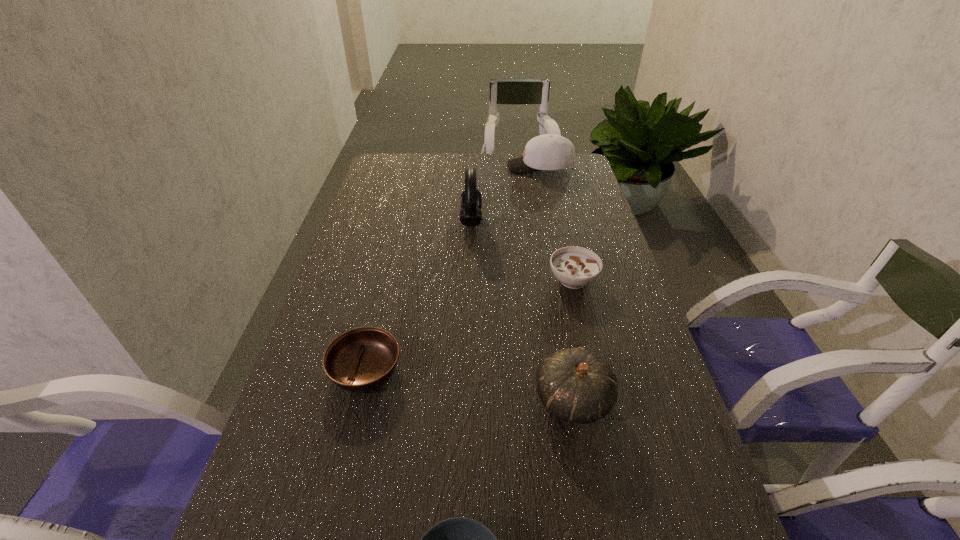
Find the location of `object that is the second closest one to the gourd`. object that is the second closest one to the gourd is located at coordinates (575, 267).

Locate which soup bowl ranks second in proximity to the third farthest object. Please provide its 2D coordinates. Your answer should be formatted as a tuple, i.e. [(x, y)], where the tuple contains the x and y coordinates of a point satisfying the conditions above.

[(459, 539)]

Where is `soup bowl that is the second closest to the headset`? The width and height of the screenshot is (960, 540). soup bowl that is the second closest to the headset is located at coordinates (362, 359).

At what (x,y) coordinates should I click in order to perform the action: click on blank area in the image that satisfies the following two spatial constraints: 1. on the earcups of the tallest object; 2. on the left side of the farthest soup bowl. Please return your answer as a coordinate pair (x, y). Looking at the image, I should click on (469, 280).

The width and height of the screenshot is (960, 540). In order to click on free space in the image that satisfies the following two spatial constraints: 1. on the front-facing side of the rightmost soup bowl; 2. on the right side of the baseball cap in this screenshot , I will do `click(564, 280)`.

You are a GUI agent. You are given a task and a screenshot of the screen. Output one action in this format:
    pyautogui.click(x=<x>, y=<y>)
    Task: Click on the free location that satisfies the following two spatial constraints: 1. on the front-facing side of the farthest object; 2. on the left side of the rightmost soup bowl
    The width and height of the screenshot is (960, 540).
    Given the screenshot: What is the action you would take?
    pyautogui.click(x=564, y=280)

Image resolution: width=960 pixels, height=540 pixels. I want to click on vacant position in the image that satisfies the following two spatial constraints: 1. on the front-facing side of the baseball cap; 2. on the back side of the farthest soup bowl, so click(564, 280).

Identify the location of free space that satisfies the following two spatial constraints: 1. on the back side of the gourd; 2. on the earcups of the headset. (540, 220).

This screenshot has height=540, width=960. In order to click on free space that satisfies the following two spatial constraints: 1. on the earcups of the headset; 2. on the left side of the rightmost soup bowl in this screenshot , I will do `click(469, 280)`.